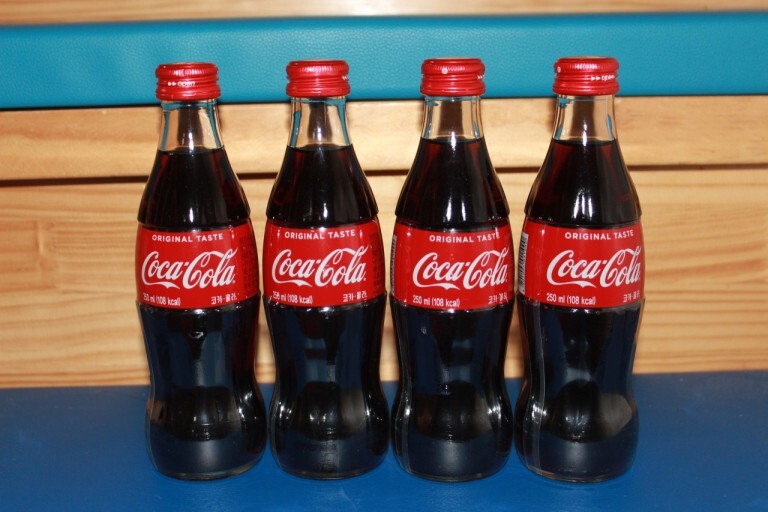
Locate an element on the screen. The image size is (768, 512). bottles of coca-cola is located at coordinates (189, 195), (333, 182), (425, 189), (590, 209).